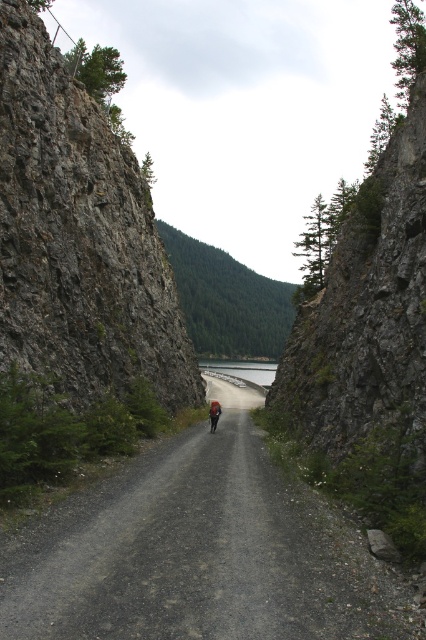
Question: Which of the following is the farthest from the observer?

Choices:
 (A) dirt/gravel road at center
 (B) green forested mountain at center
 (C) gray concrete dam at center

Answer: (C)

Question: Which point is farther from the camera taking this photo?

Choices:
 (A) (264, 298)
 (B) (322, 529)
 (C) (258, 376)

Answer: (A)

Question: Is green forested mountain at center positioned before gray concrete dam at center?

Choices:
 (A) no
 (B) yes

Answer: (B)

Question: Which object is farther from the camera taking this photo?

Choices:
 (A) green forested mountain at center
 (B) dirt/gravel road at center

Answer: (A)

Question: Does dirt/gravel road at center appear under gray concrete dam at center?

Choices:
 (A) no
 (B) yes

Answer: (A)

Question: Does green forested mountain at center have a greater width compared to gray concrete dam at center?

Choices:
 (A) yes
 (B) no

Answer: (A)